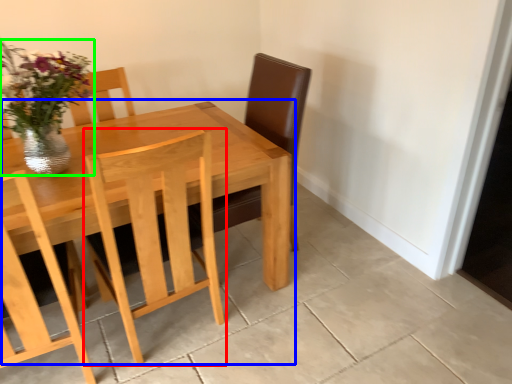
Question: Estimate the real-world distances between objects in this image. Which object is farther from chair (highlighted by a red box), kitchen & dining room table (highlighted by a blue box) or floral arrangement (highlighted by a green box)?

Choices:
 (A) kitchen & dining room table
 (B) floral arrangement

Answer: (B)